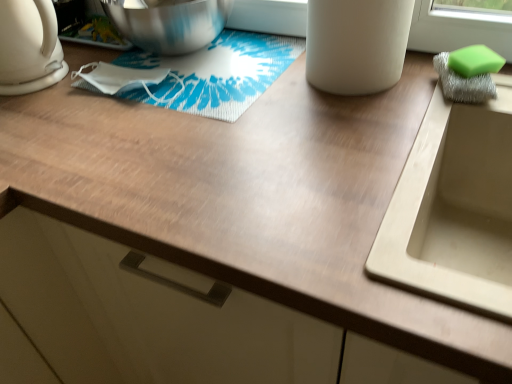
This screenshot has height=384, width=512. Identify the location of free spot to the left of green sponge at right. (385, 103).